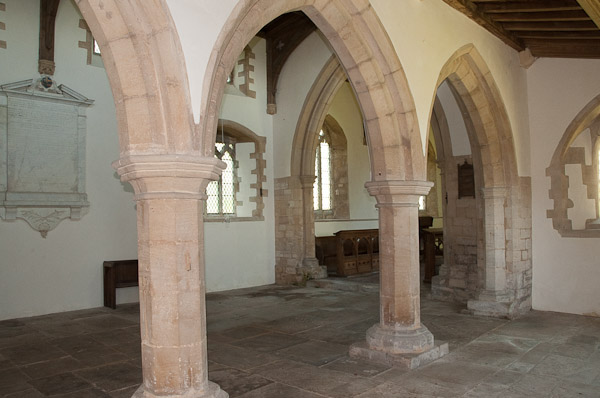
Image resolution: width=600 pixels, height=398 pixels. What are the coordinates of `table` in the screenshot? It's located at click(x=435, y=229).